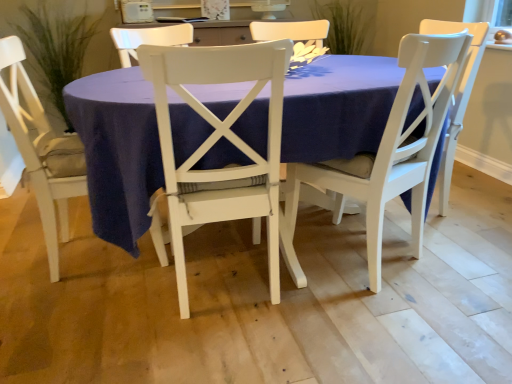
Question: Is green leafy plant at upper center, which is the 1th plant in right-to-left order, to the right of white wood chair at center, the first chair from the right, from the viewer's perspective?

Choices:
 (A) yes
 (B) no

Answer: (A)

Question: Are green leafy plant at upper center, which is the second plant in left-to-right order, and white wood chair at center, the first chair from the right, making contact?

Choices:
 (A) no
 (B) yes

Answer: (A)

Question: Can you confirm if green leafy plant at upper center, which is the second plant in left-to-right order, is bigger than white wood chair at center, the 3th chair viewed from the left?

Choices:
 (A) yes
 (B) no

Answer: (B)

Question: Does green leafy plant at upper center, which is the second plant in left-to-right order, have a greater height compared to white wood chair at center, the 3th chair viewed from the left?

Choices:
 (A) no
 (B) yes

Answer: (A)

Question: Is green leafy plant at upper center, which is the 1th plant in right-to-left order, not inside white wood chair at center, the 3th chair viewed from the left?

Choices:
 (A) yes
 (B) no

Answer: (A)

Question: Considering the positions of matte white table at center and green leafy plant at upper center, which is the 1th plant in right-to-left order, in the image, is matte white table at center bigger or smaller than green leafy plant at upper center, which is the 1th plant in right-to-left order,?

Choices:
 (A) small
 (B) big

Answer: (B)

Question: Relative to green leafy plant at upper center, which is the second plant in left-to-right order, is matte white table at center in front or behind?

Choices:
 (A) front
 (B) behind

Answer: (A)

Question: From the image's perspective, is matte white table at center above or below green leafy plant at upper center, which is the 1th plant in right-to-left order?

Choices:
 (A) below
 (B) above

Answer: (A)

Question: Would you say matte white table at center is to the left or to the right of green leafy plant at upper center, which is the second plant in left-to-right order, in the picture?

Choices:
 (A) right
 (B) left

Answer: (B)

Question: Looking at the image, does green leafy plant at left, the 1th plant from the left, seem bigger or smaller compared to white painted wood chair at lower left, marked as the 3th chair in a right-to-left arrangement?

Choices:
 (A) big
 (B) small

Answer: (B)

Question: From a real-world perspective, relative to white painted wood chair at lower left, marked as the 3th chair in a right-to-left arrangement, is green leafy plant at left, the 1th plant from the left, vertically above or below?

Choices:
 (A) above
 (B) below

Answer: (A)

Question: From the image's perspective, is green leafy plant at left, the second plant when ordered from right to left, located above or below white painted wood chair at lower left, marked as the 3th chair in a right-to-left arrangement?

Choices:
 (A) below
 (B) above

Answer: (B)

Question: Which is correct: green leafy plant at left, the 1th plant from the left, is inside white painted wood chair at lower left, marked as the 3th chair in a right-to-left arrangement, or outside of it?

Choices:
 (A) inside
 (B) outside

Answer: (B)

Question: Based on their sizes in the image, would you say white painted wood chair at lower left, marked as the 3th chair in a right-to-left arrangement, is bigger or smaller than matte white table at center?

Choices:
 (A) big
 (B) small

Answer: (B)

Question: From a real-world perspective, is white painted wood chair at lower left, marked as the 3th chair in a right-to-left arrangement, above or below matte white table at center?

Choices:
 (A) above
 (B) below

Answer: (A)